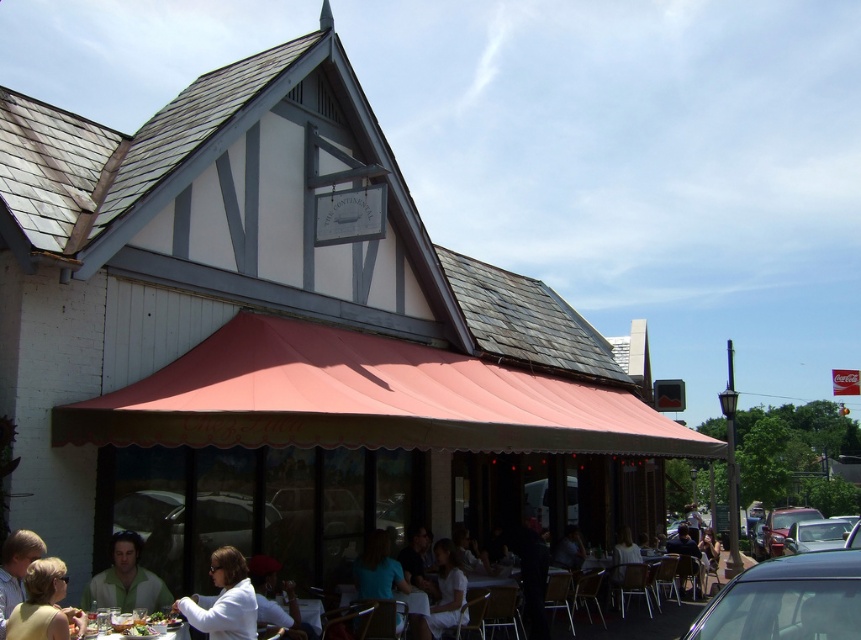
You are a photographer trying to capture a photo of the white fabric dress at lower center without the matte beige dress at lower left blocking it. What should you do?

Move to a position where the matte beige dress at lower left is no longer between you and the white fabric dress at lower center, as the matte beige dress at lower left is currently in front of the white fabric dress at lower center.

A person is standing at the center of the image. They want to move towards the matte beige dress at lower left. Which direction should they move to reach it?

The matte beige dress at lower left is located at point (42, 604), so the person should move towards the lower left direction to reach it.